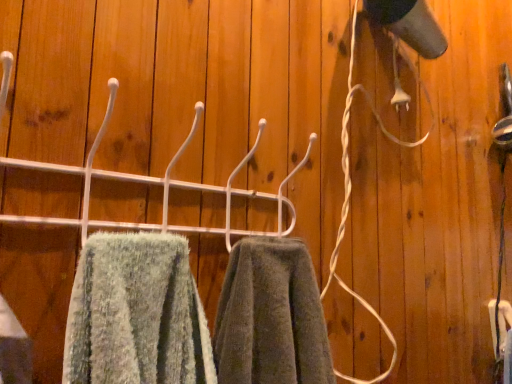
Locate an element on the screen. The width and height of the screenshot is (512, 384). white matte towel rack at center is located at coordinates (158, 185).

Describe the element at coordinates (158, 185) in the screenshot. I see `white matte towel rack at center` at that location.

Find the location of a particular element. white matte towel rack at center is located at coordinates click(158, 185).